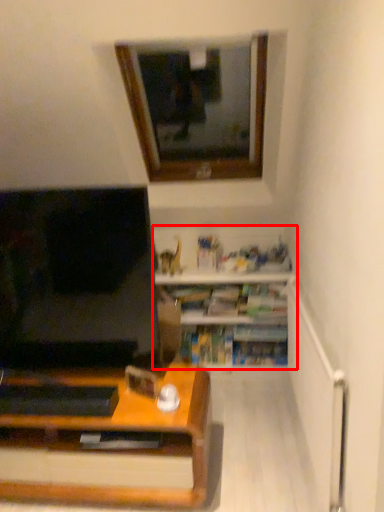
Question: From the image's perspective, what is the correct spatial positioning of shelf (annotated by the red box) in reference to window?

Choices:
 (A) above
 (B) below

Answer: (B)